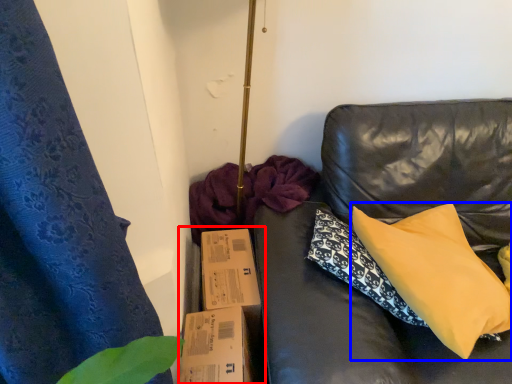
Question: Which point is closer to the camera, cardboard box (highlighted by a red box) or pillow (highlighted by a blue box)?

Choices:
 (A) cardboard box
 (B) pillow

Answer: (B)